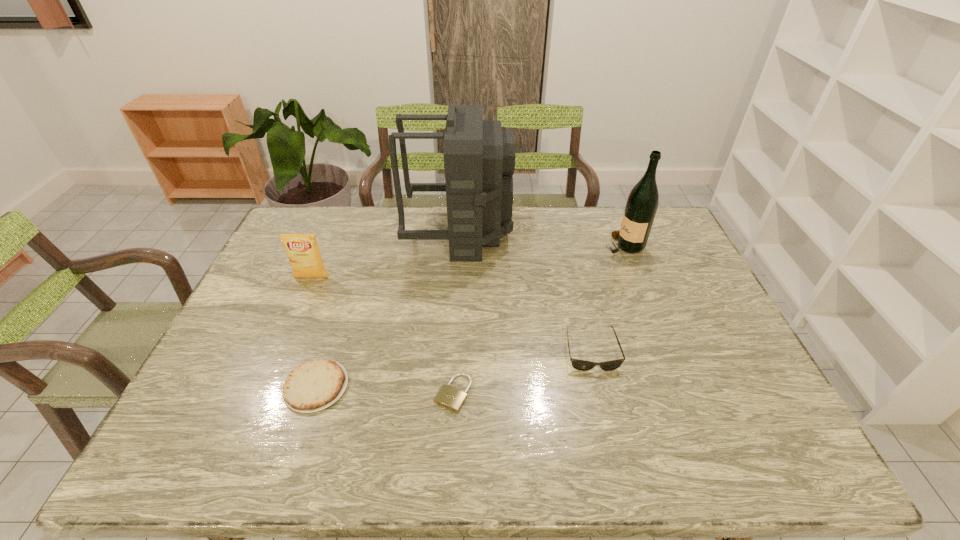
Locate an element on the screen. The image size is (960, 540). blank space located 0.280m on the front of the second tallest object is located at coordinates (651, 315).

Identify the location of vacant space located 0.350m on the front of the fourth shortest object with the logo. (271, 374).

In order to click on vacant space located on the lenses of the sunglasses in this screenshot , I will do `click(609, 425)`.

This screenshot has height=540, width=960. In order to click on blank space located on the right of the second shortest object in this screenshot , I will do coord(487,387).

This screenshot has height=540, width=960. I want to click on free spot located 0.270m on the left of the padlock, so click(325, 393).

Identify the location of backpack located at the far edge. (479, 157).

The width and height of the screenshot is (960, 540). Find the location of `wine bottle that is at the far edge`. wine bottle that is at the far edge is located at coordinates (642, 203).

In order to click on object that is at the left edge in this screenshot , I will do click(303, 252).

Locate an element on the screen. The height and width of the screenshot is (540, 960). object present at the right edge is located at coordinates (642, 203).

Locate an element on the screen. Image resolution: width=960 pixels, height=540 pixels. object that is at the far right corner is located at coordinates (642, 203).